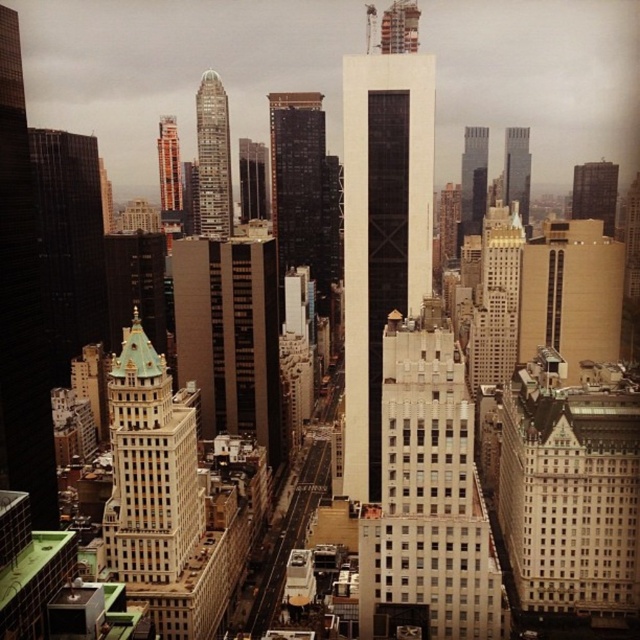
Is white textured building at center wider than white stone building at center?

No, white textured building at center is not wider than white stone building at center.

Is point (385, 385) positioned in front of point (584, 596)?

Yes, it is.

Identify the location of white textured building at center. The height and width of the screenshot is (640, 640). pyautogui.click(x=428, y=497).

Is beige concrete building at center-right shorter than white marble skyscraper at center-right?

Yes, beige concrete building at center-right is shorter than white marble skyscraper at center-right.

Can you confirm if beige concrete building at center-right is taller than white marble skyscraper at center-right?

No.

At what (x,y) coordinates should I click in order to perform the action: click on beige concrete building at center-right. Please return your answer as a coordinate pair (x, y). The width and height of the screenshot is (640, 640). Looking at the image, I should click on (570, 292).

Between orange brick building at upper center and glassy reflective skyscraper at upper right, which one appears on the right side from the viewer's perspective?

From the viewer's perspective, glassy reflective skyscraper at upper right appears more on the right side.

Does point (164, 132) come closer to viewer compared to point (524, 189)?

Yes, point (164, 132) is closer to viewer.

In order to click on orange brick building at upper center in this screenshot , I will do `click(170, 177)`.